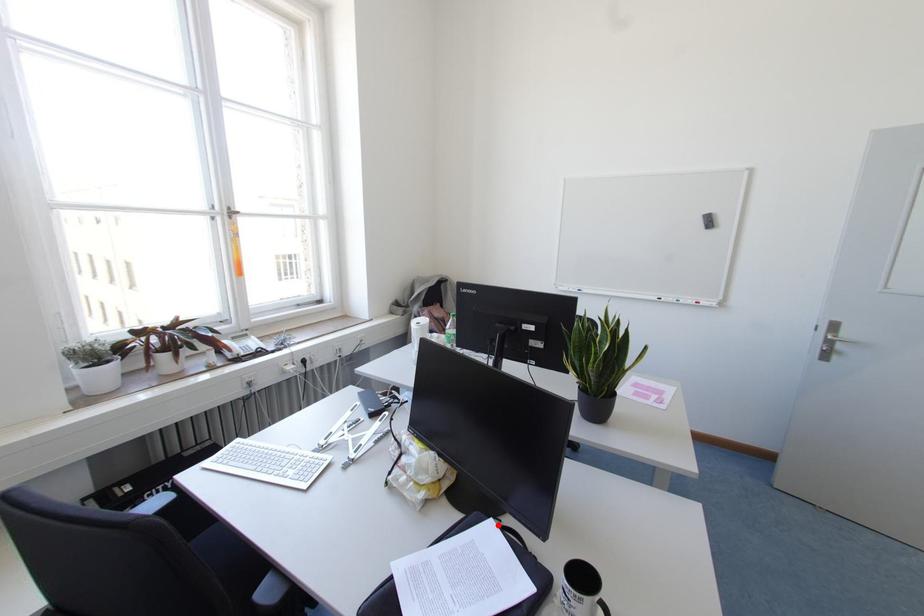
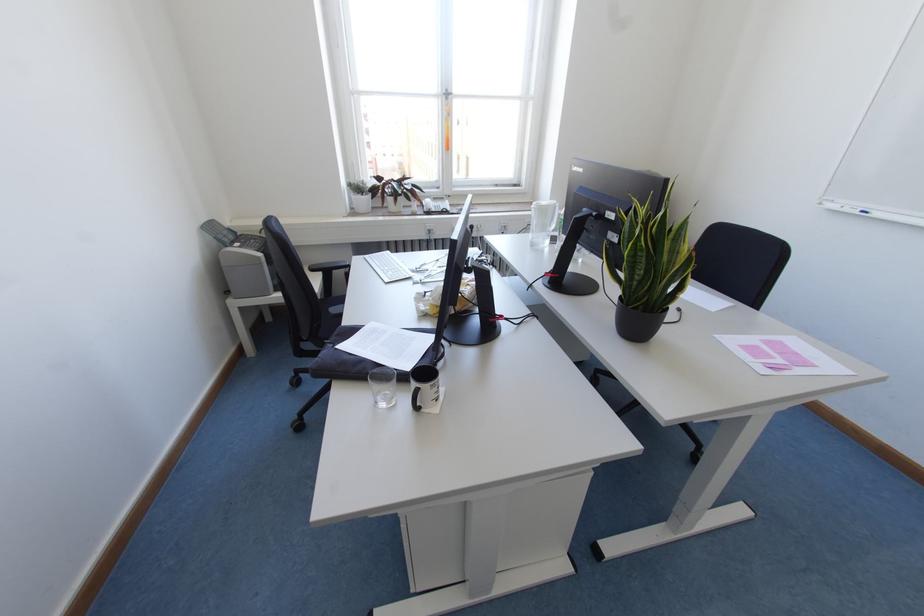
Question: I am providing you with two images of the same scene from different viewpoints. In image1, a red point is highlighted. Considering the same 3D point in image2, which of the following is correct?

Choices:
 (A) It is closer
 (B) It is farther

Answer: (A)